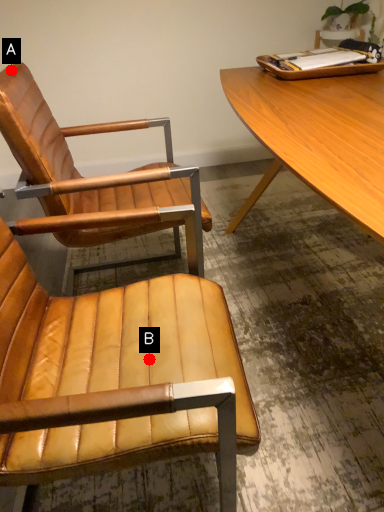
Question: Two points are circled on the image, labeled by A and B beside each circle. Which point appears farthest from the camera in this image?

Choices:
 (A) A is further
 (B) B is further

Answer: (A)